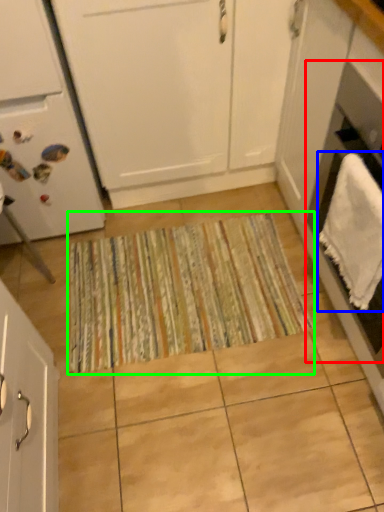
Question: Considering the real-world distances, which object is farthest from oven (highlighted by a red box)? bath towel (highlighted by a blue box) or doormat (highlighted by a green box)?

Choices:
 (A) bath towel
 (B) doormat

Answer: (B)